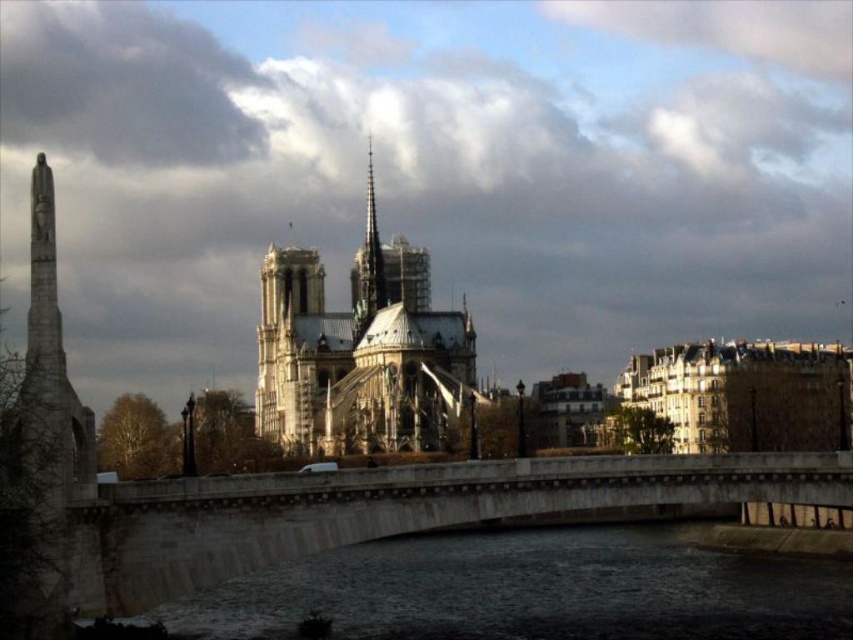
Question: Can you confirm if concrete bridge at center is thinner than stone spire at center?

Choices:
 (A) no
 (B) yes

Answer: (A)

Question: Which point is closer to the camera?

Choices:
 (A) smooth stone spire at center
 (B) stone spire at center

Answer: (B)

Question: Which of these objects is positioned closest to the stone spire at center?

Choices:
 (A) concrete bridge at center
 (B) smooth stone spire at center

Answer: (B)

Question: Is concrete bridge at center positioned in front of stone spire at center?

Choices:
 (A) no
 (B) yes

Answer: (B)

Question: Which object is closer to the camera taking this photo?

Choices:
 (A) smooth stone spire at center
 (B) stone spire at center

Answer: (B)

Question: Observing the image, what is the correct spatial positioning of concrete bridge at center in reference to smooth stone spire at center?

Choices:
 (A) left
 (B) right

Answer: (B)